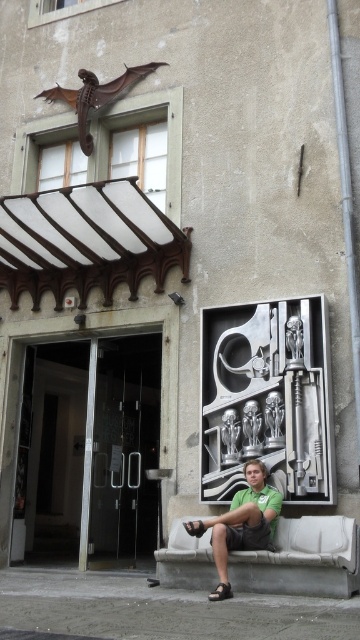
You are a photographer standing at the camera position. You want to take a photo of the white concrete bench at lower right. Is the bench within the 25 feet range of your camera lens? Please answer based on the distance provided.

The white concrete bench at lower right and camera are 25.53 feet apart from each other. Since the distance exceeds 25 feet, the bench is slightly out of the 25 feet range of the camera lens.

You are a visitor standing in front of the building and see the white concrete bench at lower right and the green matte shirt at center. Which object is closer to the entrance?

The white concrete bench at lower right is closer to the entrance because it is located below the green matte shirt at center, which places it in a lower position relative to the entrance area.